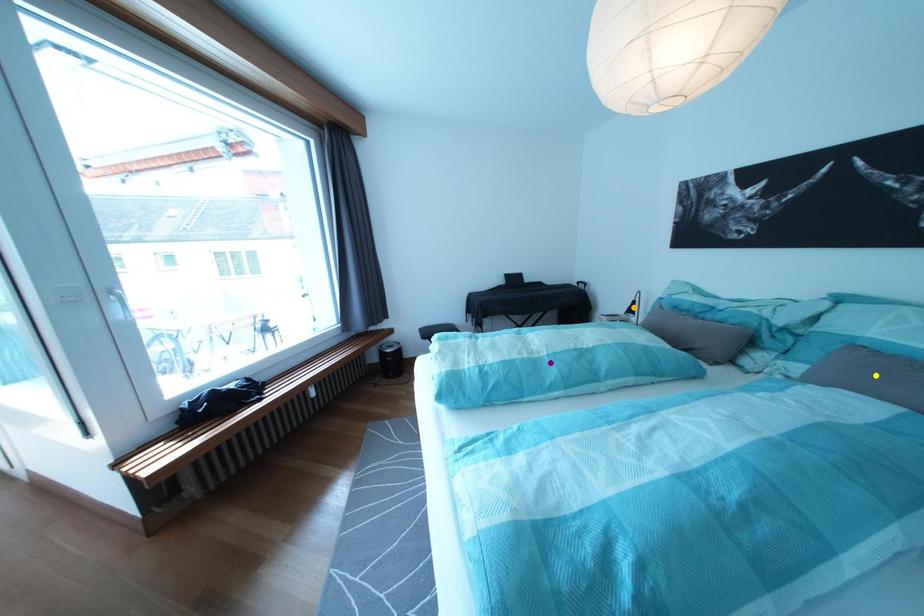
Order these from nearest to farthest:
- purple point
- yellow point
- orange point

1. yellow point
2. purple point
3. orange point